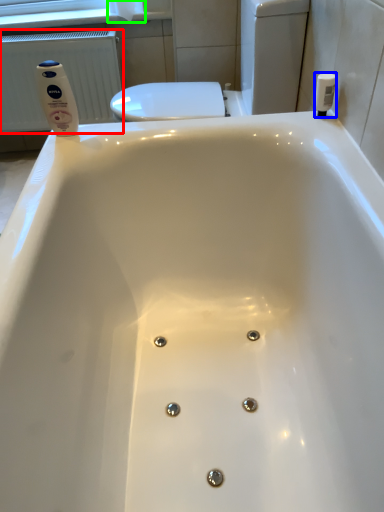
Question: Considering the real-world distances, which object is closest to radiator (highlighted by a red box)? toiletry (highlighted by a blue box) or toilet paper (highlighted by a green box).

Choices:
 (A) toiletry
 (B) toilet paper

Answer: (B)